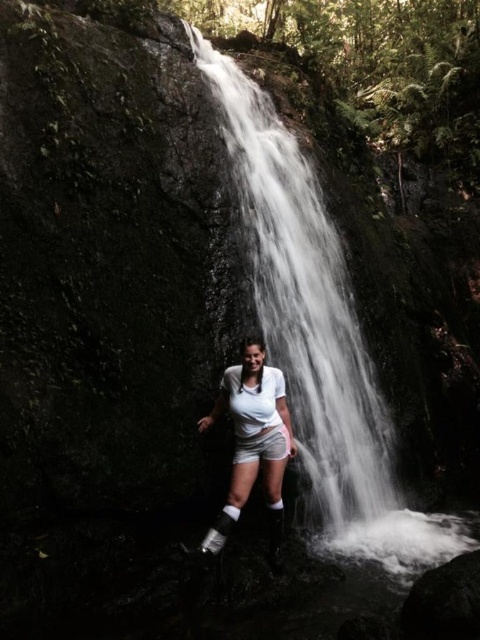
Does point (339, 428) come farther from viewer compared to point (242, 380)?

Yes.

Is white smooth waterfall at center wider than white matte shorts at center?

No, white smooth waterfall at center is not wider than white matte shorts at center.

Is point (382, 484) more distant than point (216, 541)?

Yes, point (382, 484) is farther from viewer.

This screenshot has width=480, height=640. I want to click on white smooth waterfall at center, so click(308, 314).

Is white matte shorts at center to the left of white cotton shorts at center from the viewer's perspective?

Indeed, white matte shorts at center is positioned on the left side of white cotton shorts at center.

From the picture: Can you confirm if white matte shorts at center is thinner than white cotton shorts at center?

No.

What do you see at coordinates (252, 442) in the screenshot?
I see `white matte shorts at center` at bounding box center [252, 442].

Locate an element on the screen. Image resolution: width=480 pixels, height=640 pixels. white matte shorts at center is located at coordinates (252, 442).

Based on the photo, is white smooth waterfall at center to the left of white cotton shorts at center from the viewer's perspective?

Incorrect, white smooth waterfall at center is not on the left side of white cotton shorts at center.

This screenshot has width=480, height=640. Identify the location of white smooth waterfall at center. (308, 314).

Does point (357, 468) come in front of point (288, 445)?

No, (357, 468) is further to viewer.

Image resolution: width=480 pixels, height=640 pixels. Identify the location of white smooth waterfall at center. pos(308,314).